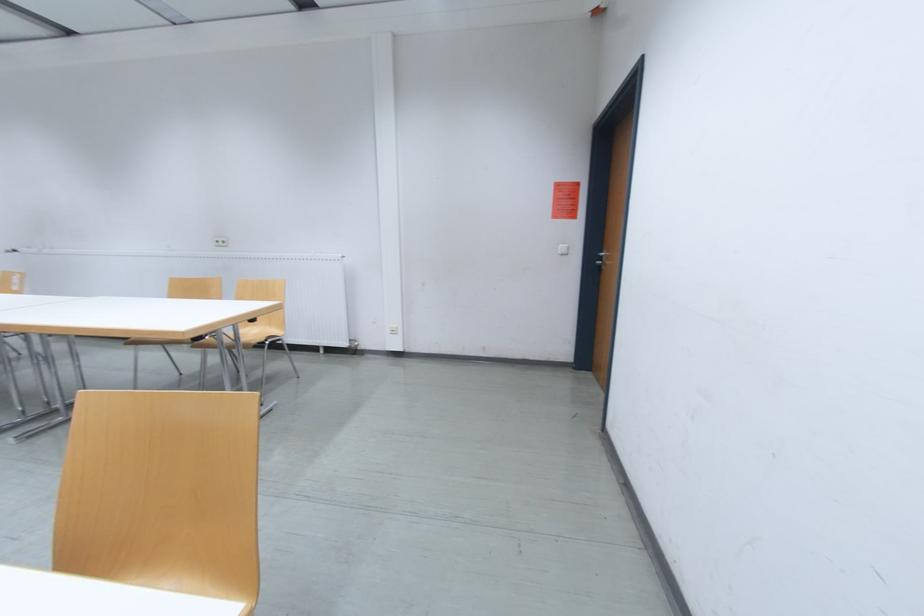
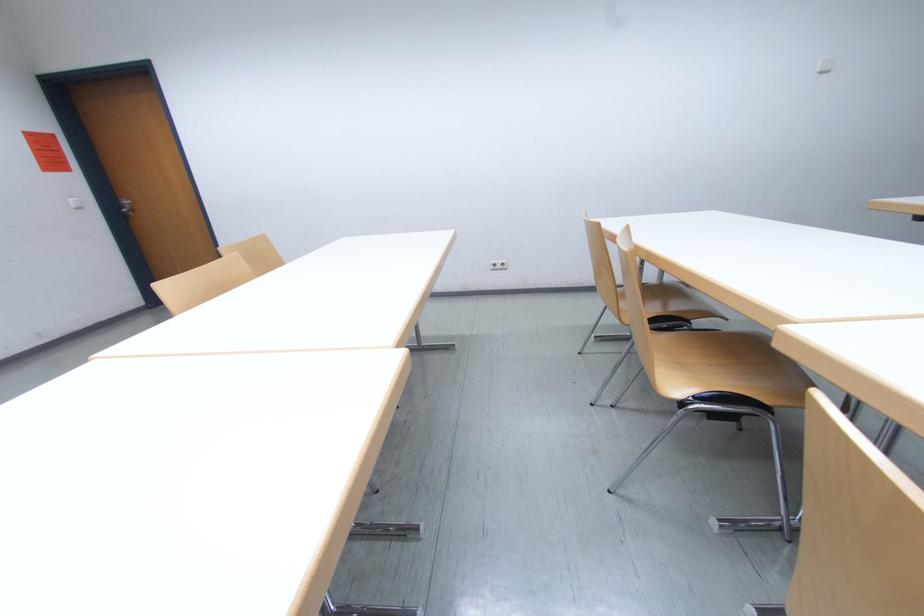
Find the pixel in the second image that matches (x=612, y=253) in the first image.

(128, 203)